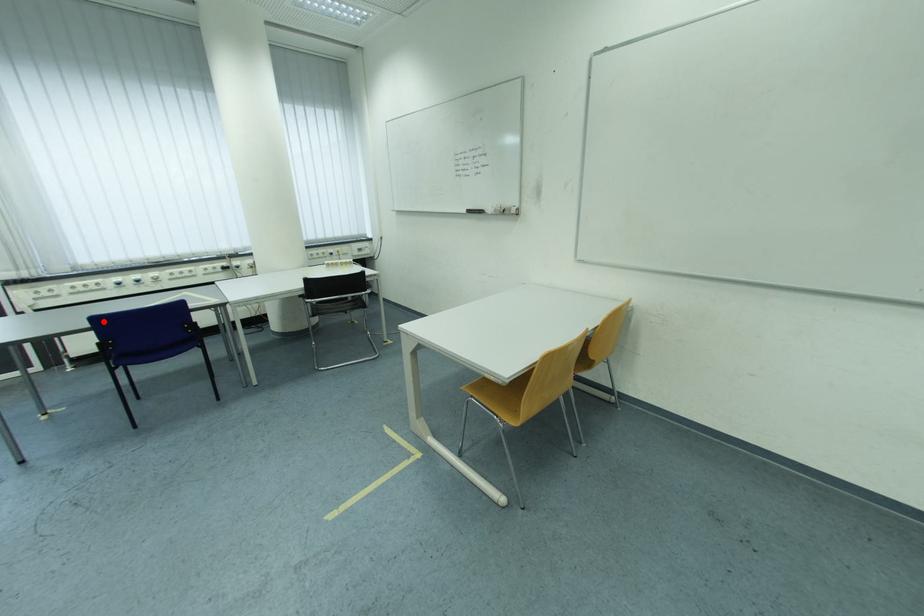
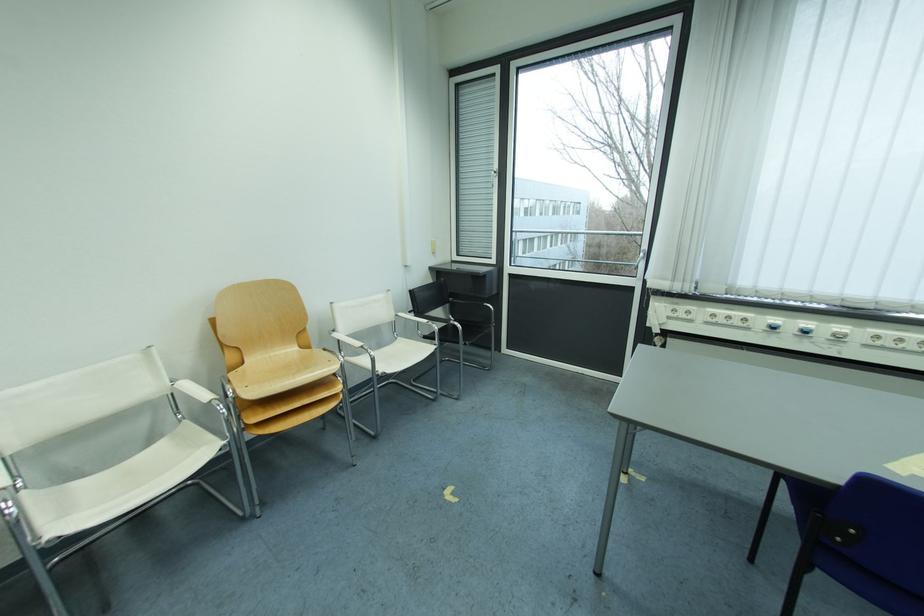
The point at the highlighted location is marked in the first image. Where is the corresponding point in the second image?

(883, 490)